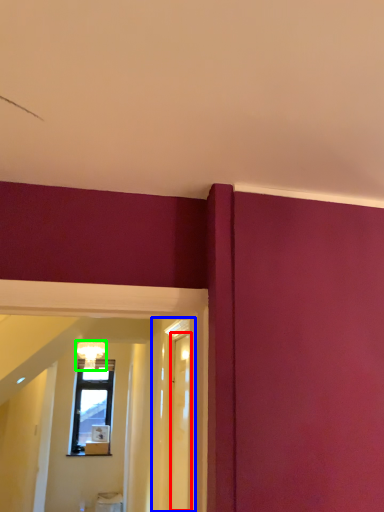
Question: Which object is the closest to the glass door (highlighted by a red box)? Choose among these: glass door (highlighted by a blue box) or light fixture (highlighted by a green box).

Choices:
 (A) glass door
 (B) light fixture

Answer: (A)